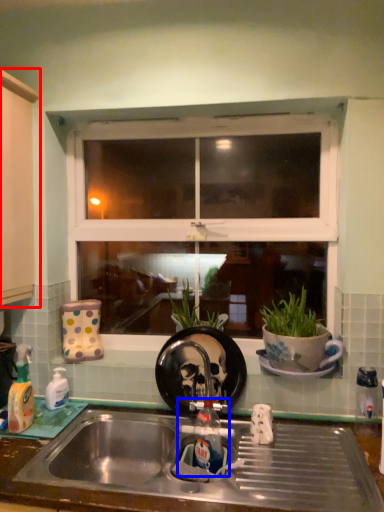
Question: Among these objects, which one is nearest to the camera, cabinetry (highlighted by a red box) or tap (highlighted by a blue box)?

Choices:
 (A) cabinetry
 (B) tap

Answer: (B)